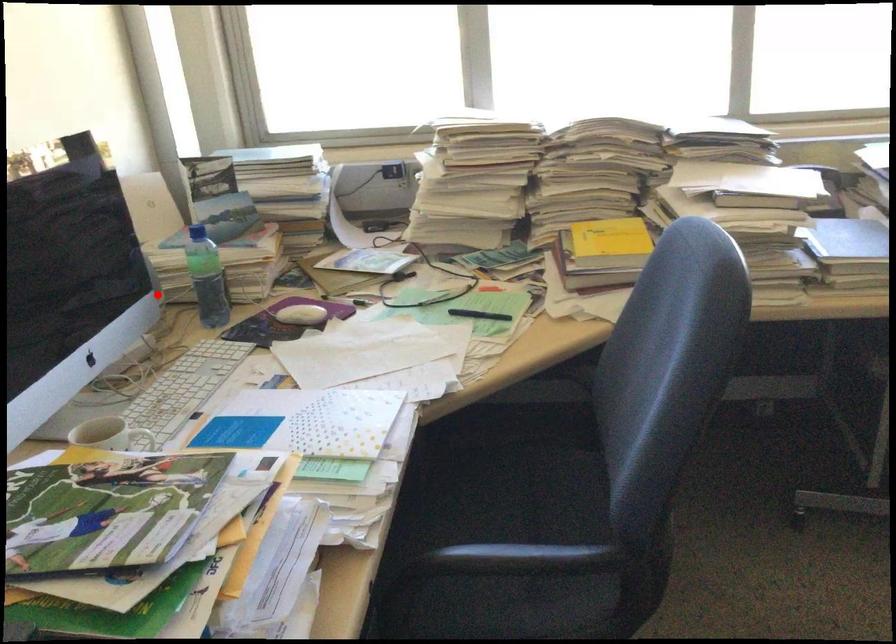
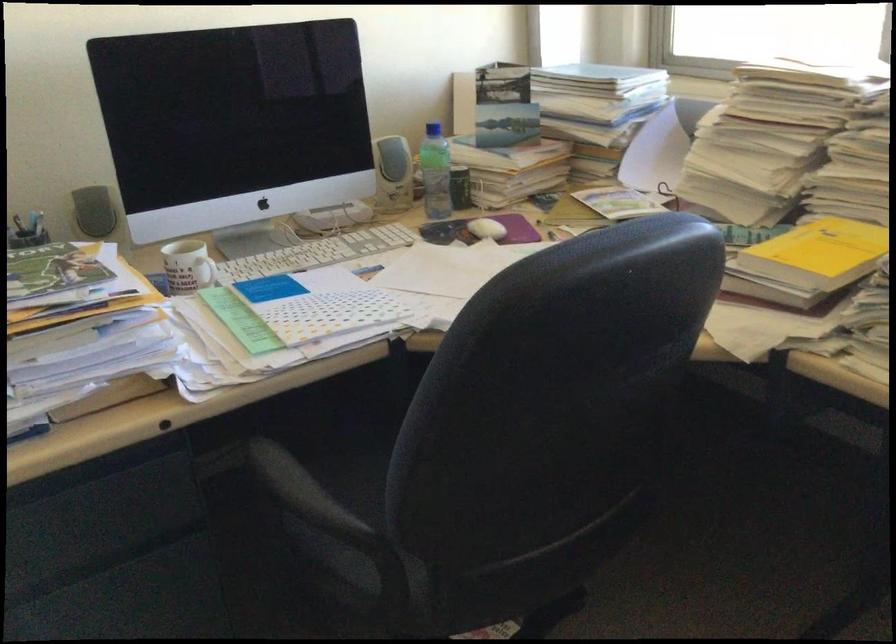
The point at the highlighted location is marked in the first image. Where is the corresponding point in the second image?

(392, 174)